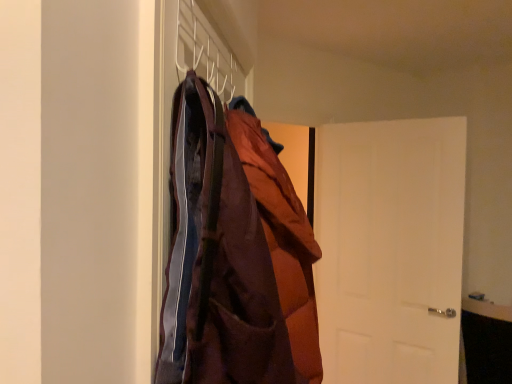
Question: Considering the positions of white matte coat hanger at upper center and white matte door at right in the image, is white matte coat hanger at upper center bigger or smaller than white matte door at right?

Choices:
 (A) small
 (B) big

Answer: (A)

Question: From a real-world perspective, is white matte coat hanger at upper center physically located above or below white matte door at right?

Choices:
 (A) above
 (B) below

Answer: (A)

Question: Estimate the real-world distances between objects in this image. Which object is closer to the white matte door at right?

Choices:
 (A) white matte coat hanger at upper center
 (B) brown quilted jacket at center

Answer: (B)

Question: Based on their relative distances, which object is nearer to the brown quilted jacket at center?

Choices:
 (A) white matte door at right
 (B) white matte coat hanger at upper center

Answer: (B)